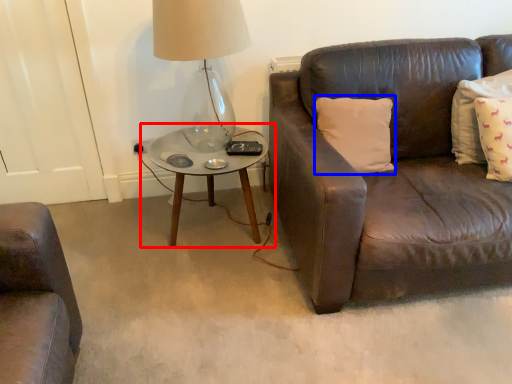
Question: Which point is further to the camera, coffee table (highlighted by a red box) or pillow (highlighted by a blue box)?

Choices:
 (A) coffee table
 (B) pillow

Answer: (A)